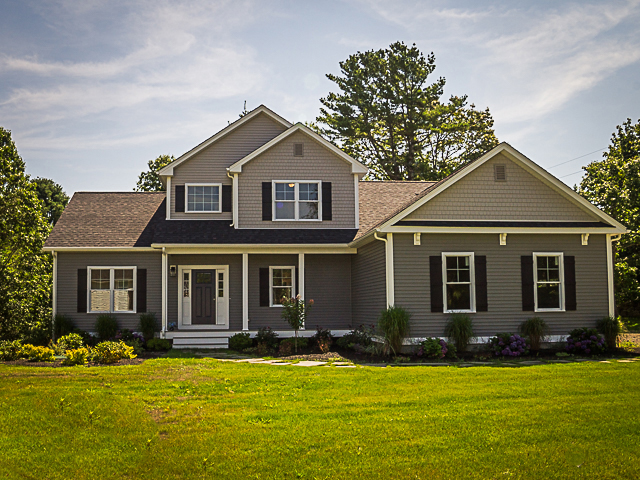
You are a GUI agent. You are given a task and a screenshot of the screen. Output one action in this format:
    pyautogui.click(x=<x>, y=<y>)
    Task: Click on the door windows
    
    Given the screenshot: What is the action you would take?
    pos(187,294), pos(182,281), pos(185,274), pos(200,277), pos(221,275), pos(221,283), pos(217,292)